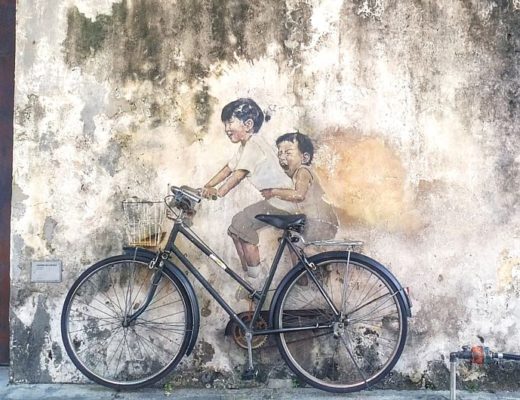
This screenshot has height=400, width=520. I want to click on basket, so click(149, 234), click(134, 202).